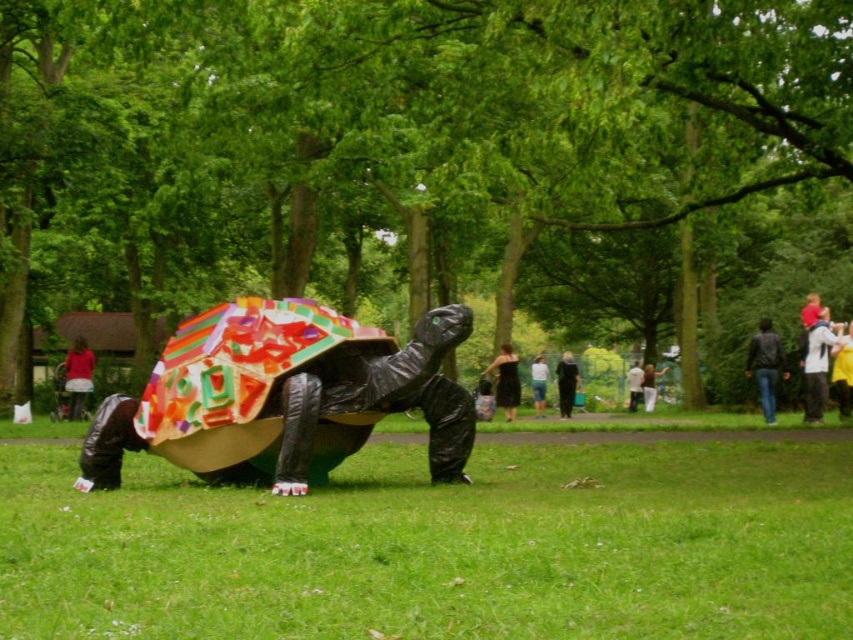
Question: Among these objects, which one is nearest to the camera?

Choices:
 (A) black dress at center
 (B) light blue jeans at center

Answer: (A)

Question: Estimate the real-world distances between objects in this image. Which object is closer to the denim jacket at center?

Choices:
 (A) green grass at lower center
 (B) white cotton shirt at center
 (C) light gray fabric jacket at center
 (D) yellow fabric at lower right

Answer: (A)

Question: Where is white cotton shirt at center located in relation to light brown leather jacket at center in the image?

Choices:
 (A) right
 (B) left

Answer: (A)

Question: Is multicolored painted shell at center to the left of brushed metal umbrella at left from the viewer's perspective?

Choices:
 (A) yes
 (B) no

Answer: (B)

Question: Is multicolored painted shell at center positioned behind yellow fabric at lower right?

Choices:
 (A) no
 (B) yes

Answer: (A)

Question: Considering the real-world distances, which object is farthest from the denim jacket at center?

Choices:
 (A) light brown leather jacket at center
 (B) black dress at center

Answer: (A)